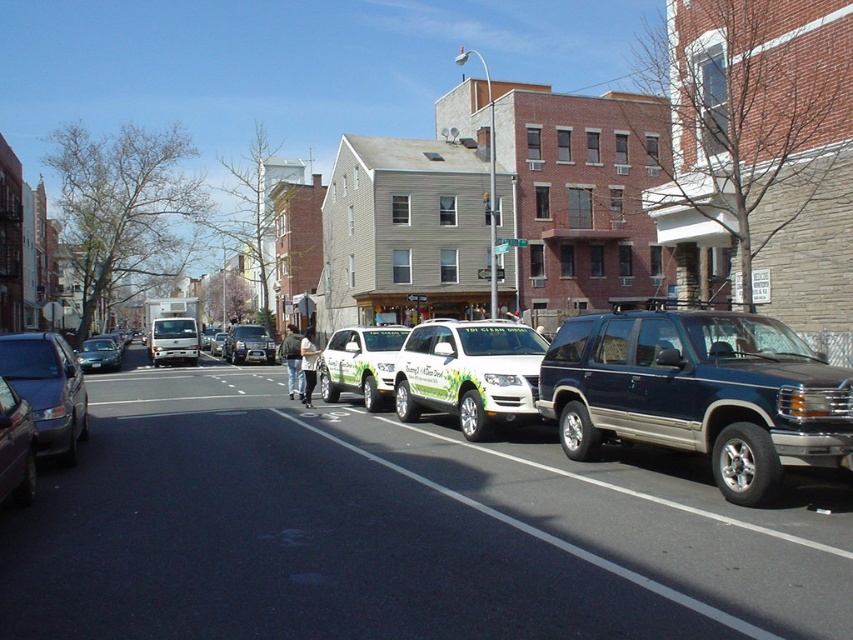
Image resolution: width=853 pixels, height=640 pixels. Identify the location of shiny silver car at center. (15, 448).

At what (x,y) coordinates should I click in order to perform the action: click on shiny silver car at center. Please return your answer as a coordinate pair (x, y). Looking at the image, I should click on (15, 448).

Does point (241, 349) come in front of point (90, 371)?

No.

Between green and white suv at center and green matte van at center, which one has more height?

green and white suv at center is taller.

Locate an element on the screen. The height and width of the screenshot is (640, 853). green and white suv at center is located at coordinates pos(248,344).

Who is taller, white glossy suv at center or white glossy van at center?

Standing taller between the two is white glossy suv at center.

Can you confirm if white glossy suv at center is thinner than white glossy van at center?

Correct, white glossy suv at center's width is less than white glossy van at center's.

Identify the location of white glossy suv at center. This screenshot has width=853, height=640. (469, 372).